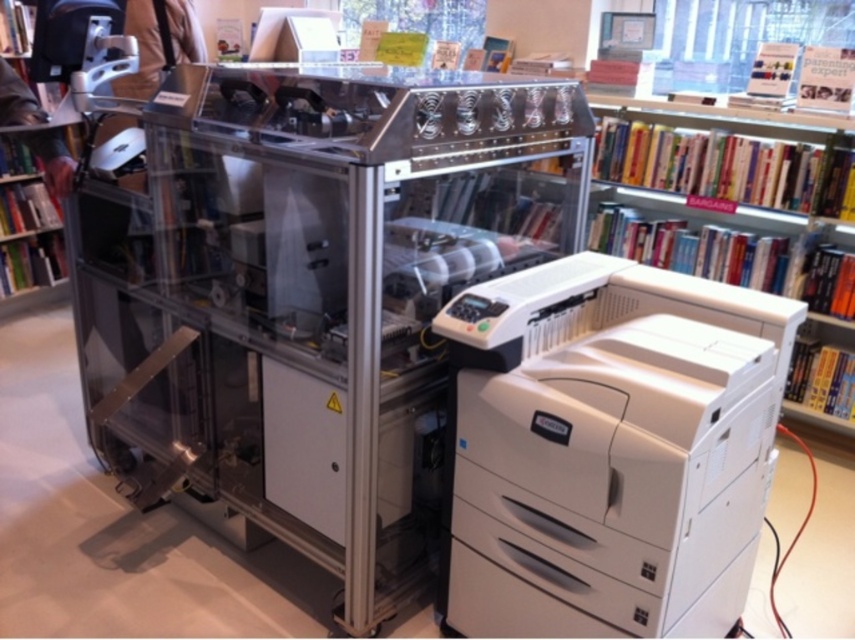
Question: Among these points, which one is nearest to the camera?

Choices:
 (A) (681, 372)
 (B) (65, 193)

Answer: (A)

Question: Can you confirm if white plastic printer at center is thinner than hardcover books at right?

Choices:
 (A) yes
 (B) no

Answer: (A)

Question: Does hardcover books at right have a larger size compared to green matte bookshelf at lower left?

Choices:
 (A) no
 (B) yes

Answer: (B)

Question: Which of the following is the farthest from the observer?

Choices:
 (A) white plastic printer at center
 (B) green matte bookshelf at lower left
 (C) hardcover books at right

Answer: (C)

Question: Is hardcover books at right positioned before green matte bookshelf at lower left?

Choices:
 (A) yes
 (B) no

Answer: (B)

Question: Among these points, which one is farthest from the camera?

Choices:
 (A) (27, 106)
 (B) (711, 436)

Answer: (A)